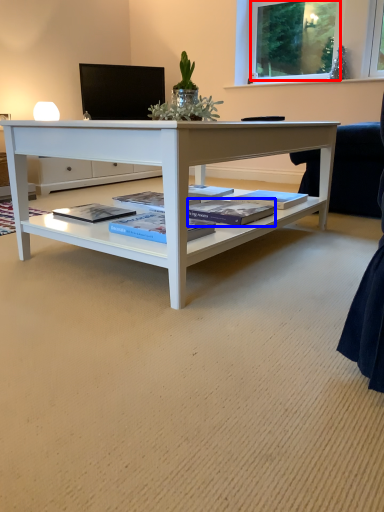
Question: Among these objects, which one is nearest to the camera, window screen (highlighted by a red box) or magazine (highlighted by a blue box)?

Choices:
 (A) window screen
 (B) magazine

Answer: (B)